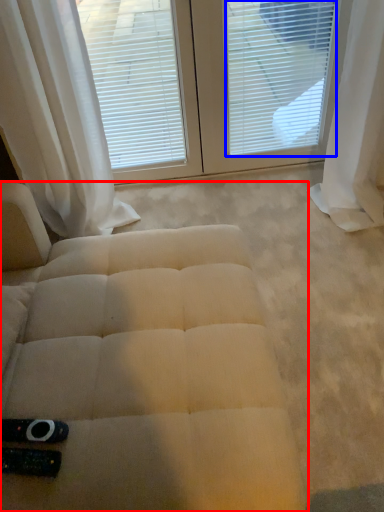
Question: Which point is further to the camera, furniture (highlighted by a red box) or blind (highlighted by a blue box)?

Choices:
 (A) furniture
 (B) blind

Answer: (B)